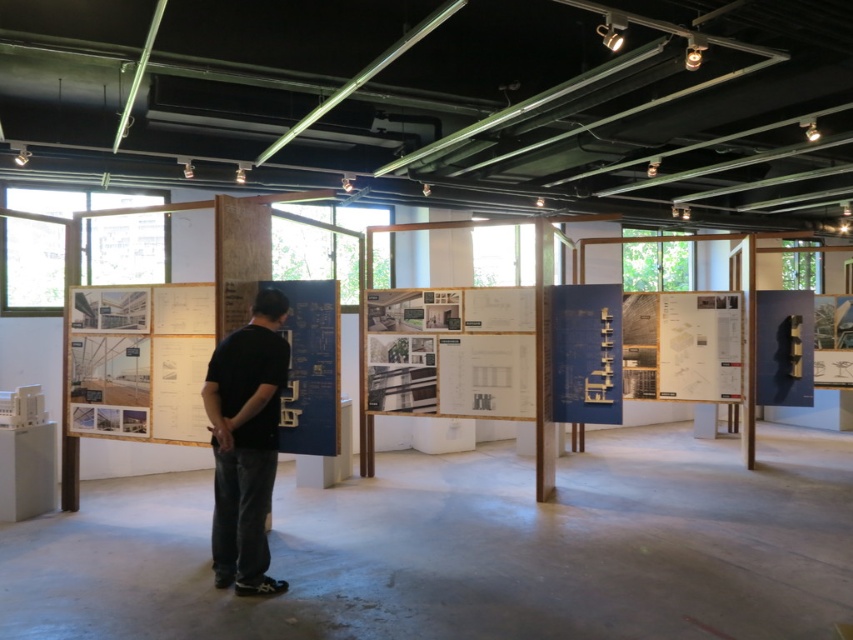
You are an architect visiting the exhibition. You need to place a 1.2 meter wide model of a building on either the white paperboard at center or the white paper at center. Based on their sizes, which surface can accommodate the model without it hanging off the edge?

The white paperboard at center has a larger width than the white paper at center. Since the model is 1.2 meters wide, the white paperboard at center is the appropriate choice as it can accommodate the model without it hanging off the edge.

You are an event planner preparing for a presentation in this exhibition space. You notice the black cotton shirt at center and the matte paper poster at center. Which object is positioned lower in the scene?

The black cotton shirt at center is located below the matte paper poster at center, so it is positioned lower in the scene.